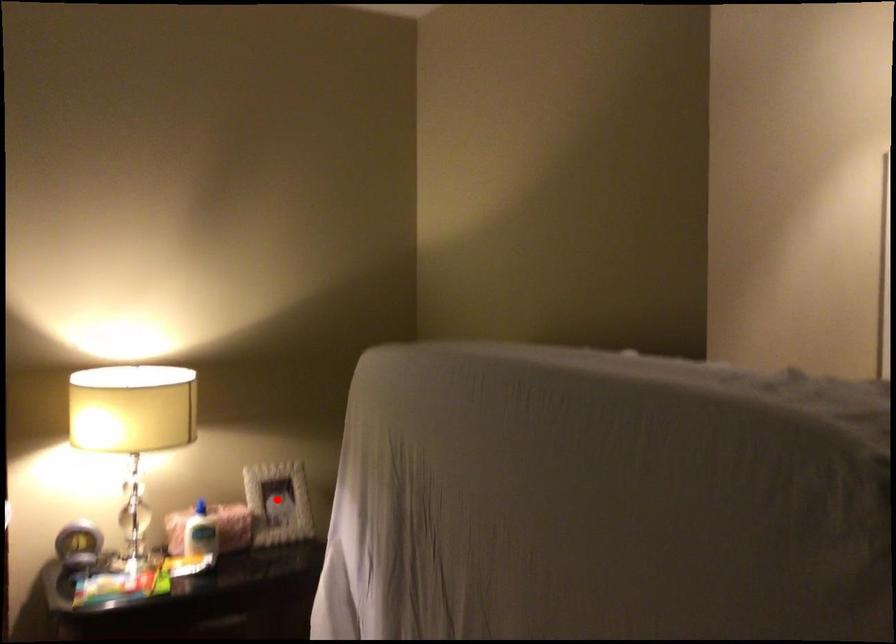
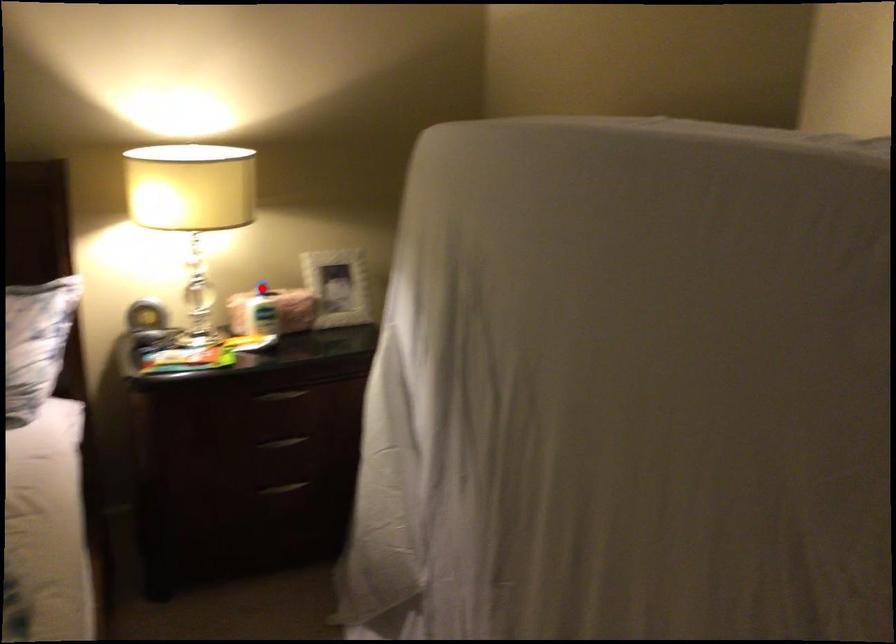
I am providing you with two images of the same scene from different viewpoints. A red point is marked on the first image and another point is marked on the second image. Are the points marked in image1 and image2 representing the same 3D position?

No